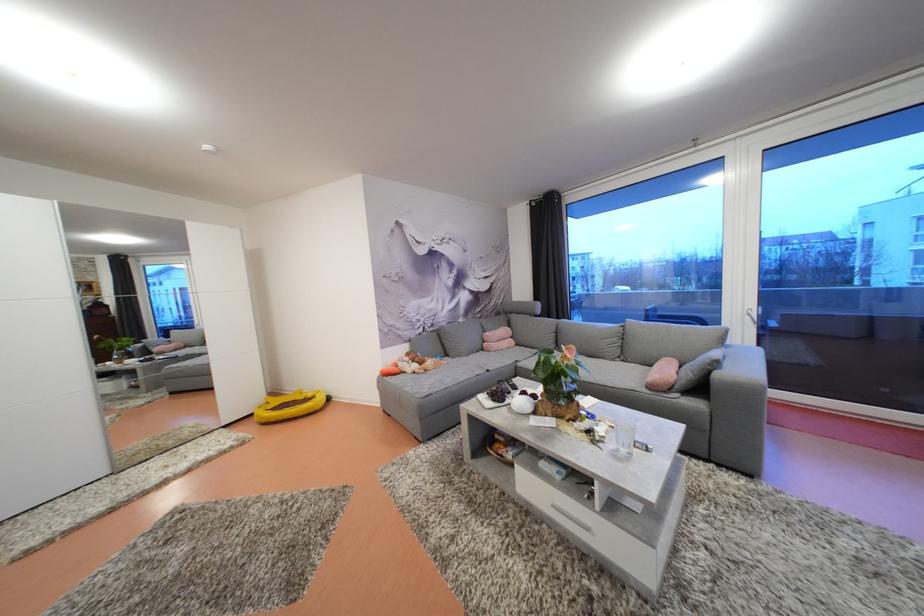
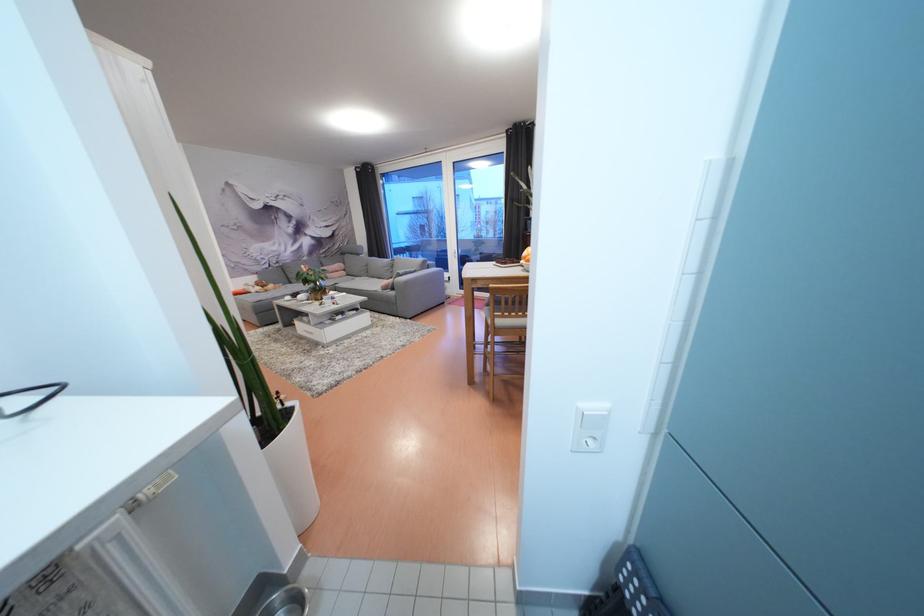
What movement of the cameraman would produce the second image?

The cameraman moved toward right, backward.